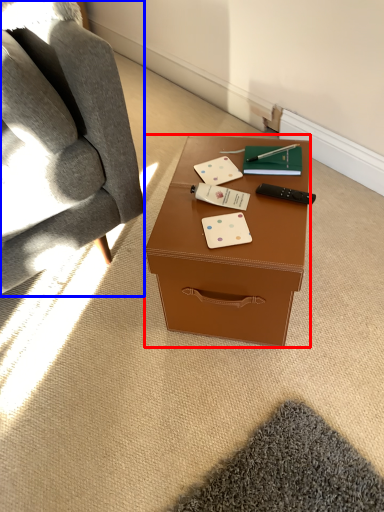
Question: Among these objects, which one is farthest to the camera, desk (highlighted by a red box) or chair (highlighted by a blue box)?

Choices:
 (A) desk
 (B) chair

Answer: (A)